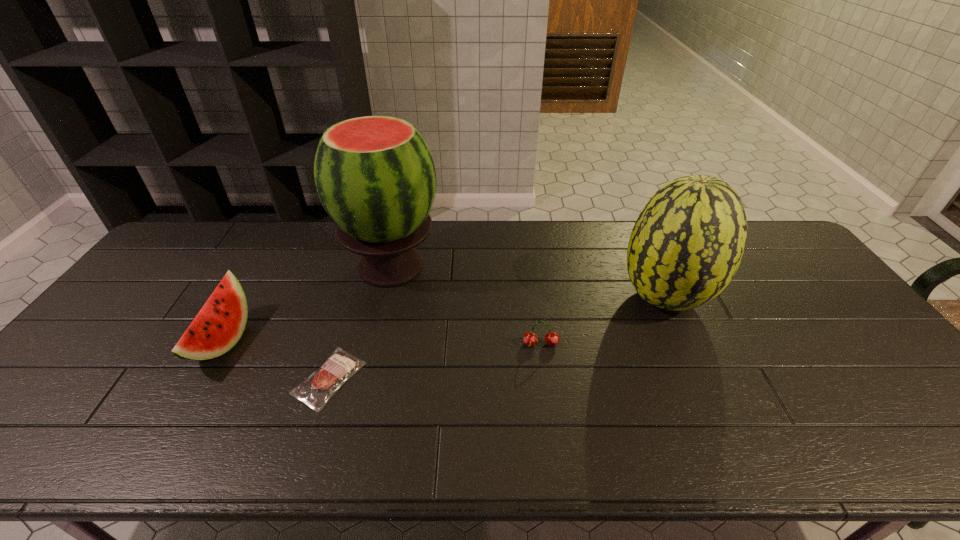
The height and width of the screenshot is (540, 960). I want to click on the second watermelon from right to left, so click(x=375, y=176).

Find the location of a particular element. The width and height of the screenshot is (960, 540). the second shortest watermelon is located at coordinates pos(688,241).

This screenshot has height=540, width=960. In order to click on the rightmost object in this screenshot , I will do `click(688, 241)`.

The height and width of the screenshot is (540, 960). Find the location of `the third tallest object`. the third tallest object is located at coordinates (220, 323).

You are a GUI agent. You are given a task and a screenshot of the screen. Output one action in this format:
    pyautogui.click(x=<x>, y=<y>)
    Task: Click on the leftmost watermelon
    This screenshot has width=960, height=540.
    Given the screenshot: What is the action you would take?
    pyautogui.click(x=220, y=323)

Find the location of `the fourth tallest object`. the fourth tallest object is located at coordinates [552, 338].

The width and height of the screenshot is (960, 540). In order to click on the fourth object from left to right in this screenshot , I will do `click(552, 338)`.

Locate an element on the screen. the shortest object is located at coordinates (321, 385).

Locate an element on the screen. The image size is (960, 540). vacant region located 0.300m on the left of the second watermelon from right to left is located at coordinates (247, 267).

Locate an element on the screen. free space located 0.300m on the front of the rightmost watermelon is located at coordinates (729, 438).